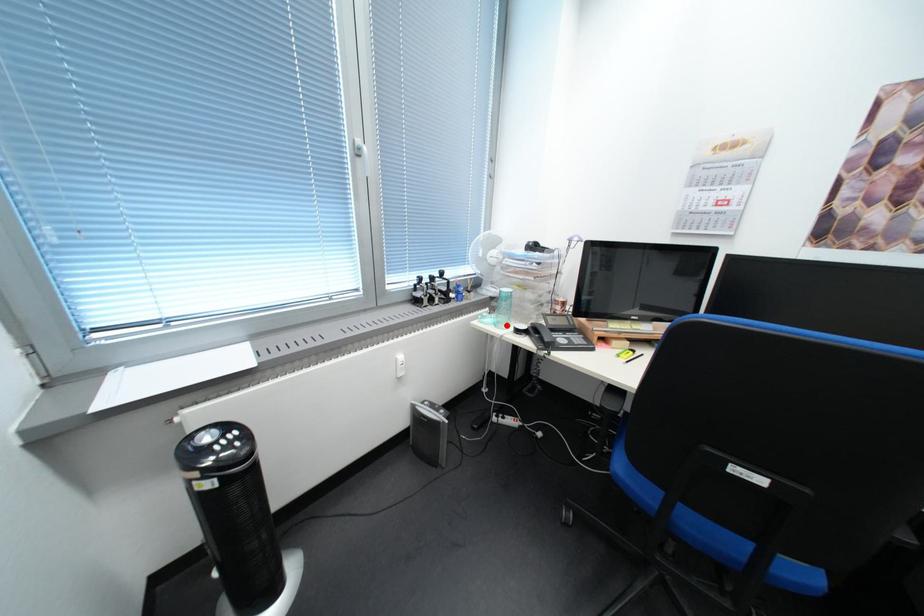
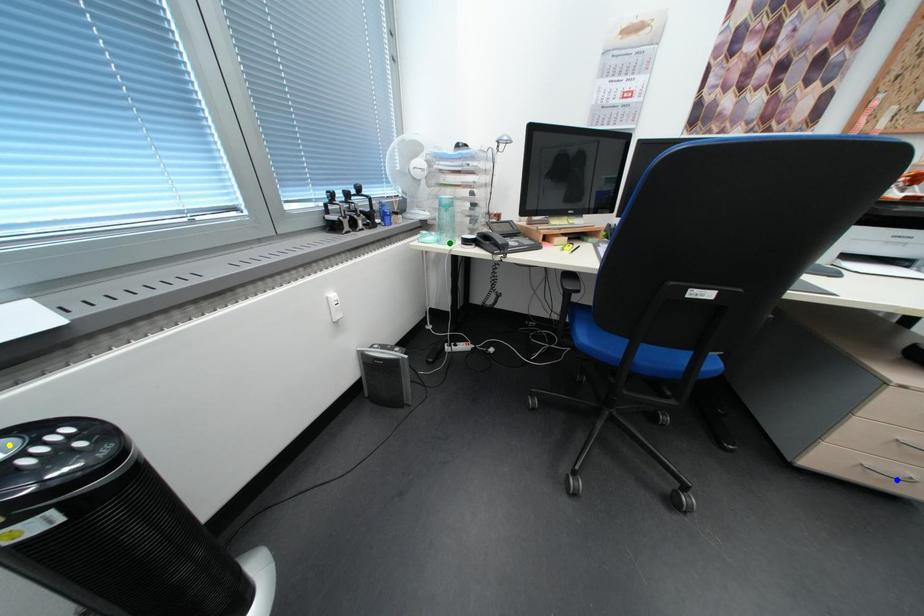
Question: I am providing you with two images of the same scene from different viewpoints. A red point is marked on the first image. You are given multiple points on the second image. Which point in image 2 is actually the same real-world point as the red point in image 1?

Choices:
 (A) green point
 (B) blue point
 (C) yellow point

Answer: (A)